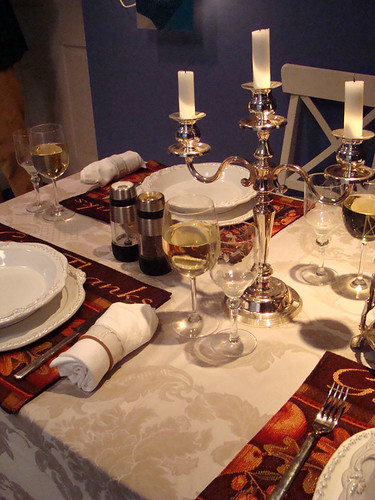
You are a GUI agent. You are given a task and a screenshot of the screen. Output one action in this format:
    pyautogui.click(x=<x>, y=<y>)
    Task: Click on the bottom of stems of wine glasses
    The width and height of the screenshot is (375, 500).
    Given the screenshot: What is the action you would take?
    195,315, 237,340, 59,208, 40,200, 320,267, 360,279